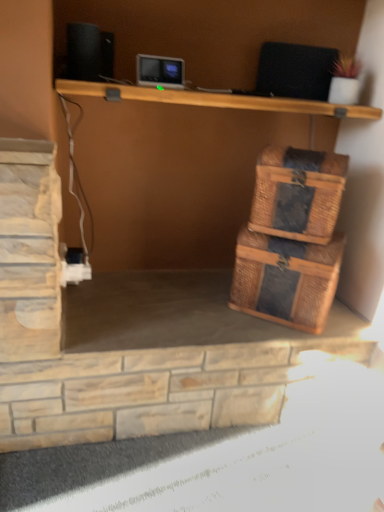
Question: Is point (276, 239) positioned closer to the camera than point (102, 70)?

Choices:
 (A) farther
 (B) closer

Answer: (B)

Question: Is rattan woven storage box at lower right in front of or behind black matte speaker at upper left in the image?

Choices:
 (A) front
 (B) behind

Answer: (B)

Question: Estimate the real-world distances between objects in this image. Which object is closer to the rattan woven storage box at lower right?

Choices:
 (A) black matte speaker at upper left
 (B) rattan basket at right

Answer: (B)

Question: Estimate the real-world distances between objects in this image. Which object is closer to the rattan woven storage box at lower right?

Choices:
 (A) rattan basket at right
 (B) black matte speaker at upper left

Answer: (A)